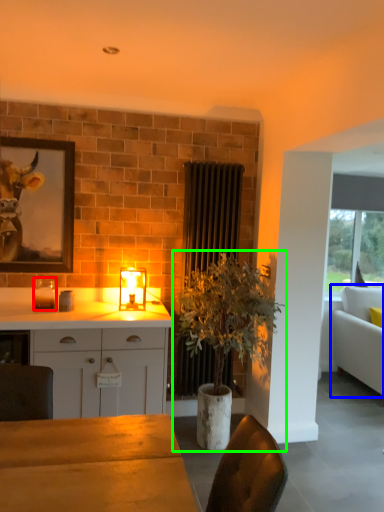
Question: Which object is positioned closest to candle holder (highlighted by a red box)? Select from studio couch (highlighted by a blue box) and houseplant (highlighted by a green box).

Choices:
 (A) studio couch
 (B) houseplant

Answer: (B)